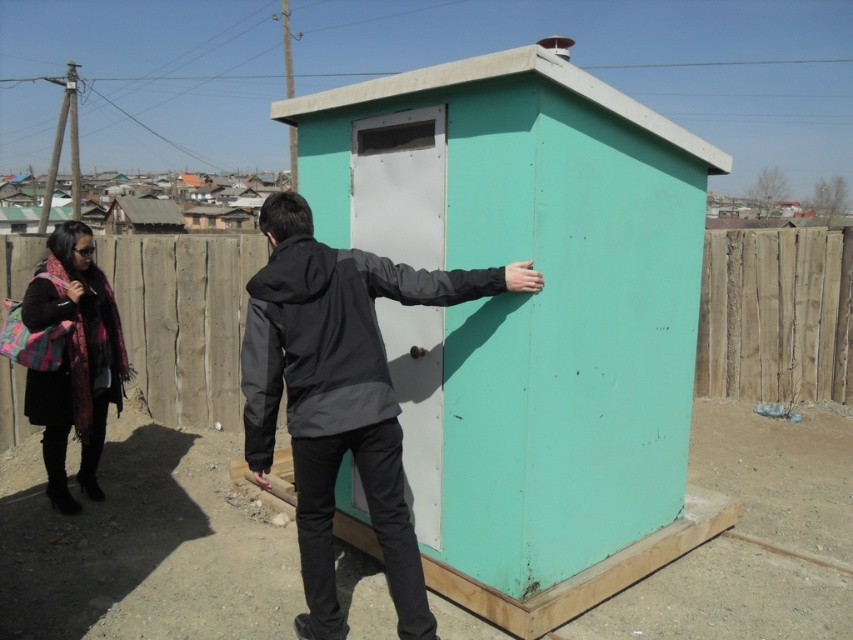
You are standing in front of the teal portable toilet structure. There are two points marked on the structure. One is at coordinate point (799, 396) and the other is at point (68, 272). Which of these points is closer to your eyes?

Point (68, 272) is closer to your eyes because it is less further to the camera than point (799, 396).